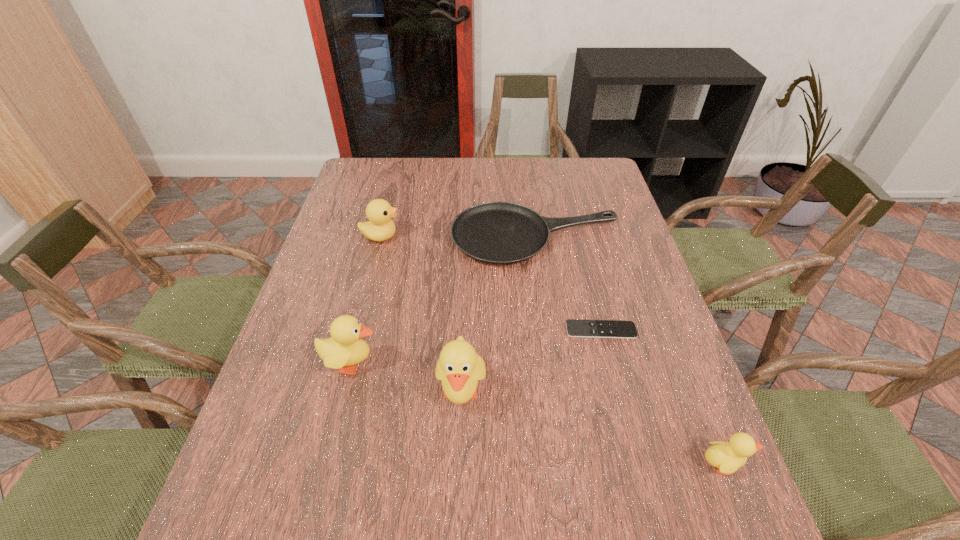
Where is `free space between the shortest object and the second duckling from left to right`? free space between the shortest object and the second duckling from left to right is located at coordinates (531, 362).

Find the location of a particular element. vacant area between the nearest object and the leftmost duckling is located at coordinates (537, 414).

Find the location of `free point between the nearest object and the second duckling from left to right`. free point between the nearest object and the second duckling from left to right is located at coordinates (591, 428).

The width and height of the screenshot is (960, 540). I want to click on empty space that is in between the shortest object and the second shortest object, so pyautogui.click(x=568, y=284).

You are a GUI agent. You are given a task and a screenshot of the screen. Output one action in this format:
    pyautogui.click(x=<x>, y=<y>)
    Task: Click on the vacant region between the second shortest object and the second tallest object
    The height and width of the screenshot is (540, 960).
    Given the screenshot: What is the action you would take?
    pyautogui.click(x=444, y=300)

At what (x,y) coordinates should I click in order to perform the action: click on unoccupied area between the fourth tallest object and the frying pan. Please return your answer as a coordinate pair (x, y). The height and width of the screenshot is (540, 960). Looking at the image, I should click on (630, 350).

Locate an element on the screen. The image size is (960, 540). vacant space that is in between the frying pan and the shortest object is located at coordinates (568, 284).

Point out which object is positioned as the fourth nearest to the second duckling from left to right. Please provide its 2D coordinates. Your answer should be formatted as a tuple, i.e. [(x, y)], where the tuple contains the x and y coordinates of a point satisfying the conditions above.

[(727, 457)]

Point out which object is positioned as the fourth nearest to the remote control. Please provide its 2D coordinates. Your answer should be formatted as a tuple, i.e. [(x, y)], where the tuple contains the x and y coordinates of a point satisfying the conditions above.

[(345, 347)]

Choose which duckling is the third nearest neighbor to the remote control. Please provide its 2D coordinates. Your answer should be formatted as a tuple, i.e. [(x, y)], where the tuple contains the x and y coordinates of a point satisfying the conditions above.

[(345, 347)]